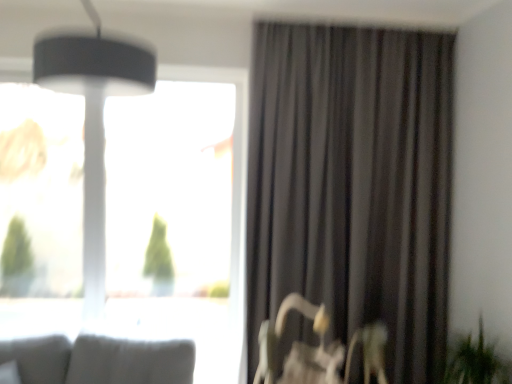
The image size is (512, 384). Describe the element at coordinates (353, 185) in the screenshot. I see `dark grey fabric curtain at right` at that location.

Describe the element at coordinates (476, 362) in the screenshot. I see `green leafy plant at lower right` at that location.

In order to face metallic silver swivel chair at lower right, should I rotate leftwards or rightwards?

You should rotate right by 9.099 degrees.

The image size is (512, 384). What do you see at coordinates (180, 213) in the screenshot?
I see `transparent glass window at upper left` at bounding box center [180, 213].

Locate an element on the screen. This screenshot has width=512, height=384. matte black lampshade at upper left is located at coordinates (93, 63).

Identify the location of dark grey fabric curtain at right. The height and width of the screenshot is (384, 512). (353, 185).

Between metallic silver swivel chair at lower right and matte black lampshade at upper left, which one has smaller size?

Smaller between the two is matte black lampshade at upper left.

Is metallic silver swivel chair at lower right situated inside matte black lampshade at upper left or outside?

metallic silver swivel chair at lower right lies outside matte black lampshade at upper left.

Is point (318, 364) closer to viewer compared to point (55, 47)?

No, it is behind (55, 47).

From a real-world perspective, is metallic silver swivel chair at lower right physically above matte black lampshade at upper left?

Incorrect, from a real-world perspective, metallic silver swivel chair at lower right is lower than matte black lampshade at upper left.

Who is shorter, transparent glass window at upper left or dark grey fabric curtain at right?

With less height is transparent glass window at upper left.

Does point (136, 137) lie in front of point (394, 354)?

No, (136, 137) is behind (394, 354).

From the image's perspective, would you say transparent glass window at upper left is positioned over dark grey fabric curtain at right?

Actually, transparent glass window at upper left appears below dark grey fabric curtain at right in the image.

Is transparent glass window at upper left facing towards dark grey fabric curtain at right?

No.

Who is bigger, transparent glass window at upper left or metallic silver swivel chair at lower right?

metallic silver swivel chair at lower right.

In terms of width, does transparent glass window at upper left look wider or thinner when compared to metallic silver swivel chair at lower right?

Considering their sizes, transparent glass window at upper left looks slimmer than metallic silver swivel chair at lower right.

Where is `window above the metallic silver swivel chair at lower right (from a real-world perspective)`? window above the metallic silver swivel chair at lower right (from a real-world perspective) is located at coordinates (180, 213).

Is transparent glass window at upper left looking in the opposite direction of metallic silver swivel chair at lower right?

No, transparent glass window at upper left is not facing the opposite direction of metallic silver swivel chair at lower right.

Considering the relative sizes of metallic silver swivel chair at lower right and dark grey fabric curtain at right in the image provided, is metallic silver swivel chair at lower right taller than dark grey fabric curtain at right?

No.

From the image's perspective, is metallic silver swivel chair at lower right beneath dark grey fabric curtain at right?

Yes, from the image's perspective, metallic silver swivel chair at lower right is beneath dark grey fabric curtain at right.

Considering the sizes of metallic silver swivel chair at lower right and dark grey fabric curtain at right in the image, is metallic silver swivel chair at lower right bigger or smaller than dark grey fabric curtain at right?

In the image, metallic silver swivel chair at lower right appears to be smaller than dark grey fabric curtain at right.

Looking at their sizes, would you say metallic silver swivel chair at lower right is wider or thinner than dark grey fabric curtain at right?

Clearly, metallic silver swivel chair at lower right has more width compared to dark grey fabric curtain at right.

From the image's perspective, is dark grey fabric curtain at right above metallic silver swivel chair at lower right?

Yes, from the image's perspective, dark grey fabric curtain at right is over metallic silver swivel chair at lower right.

Between dark grey fabric curtain at right and metallic silver swivel chair at lower right, which one appears on the left side from the viewer's perspective?

From the viewer's perspective, metallic silver swivel chair at lower right appears more on the left side.

In the scene shown: Measure the distance between dark grey fabric curtain at right and metallic silver swivel chair at lower right.

dark grey fabric curtain at right and metallic silver swivel chair at lower right are 25.63 inches apart from each other.

Is the position of dark grey fabric curtain at right more distant than that of metallic silver swivel chair at lower right?

Yes, the depth of dark grey fabric curtain at right is greater than that of metallic silver swivel chair at lower right.

Is metallic silver swivel chair at lower right directly adjacent to transparent glass window at upper left?

No, metallic silver swivel chair at lower right is not beside transparent glass window at upper left.

Is transparent glass window at upper left at the back of metallic silver swivel chair at lower right?

No, metallic silver swivel chair at lower right is not facing the opposite direction of transparent glass window at upper left.

Is transparent glass window at upper left surrounded by metallic silver swivel chair at lower right?

No.

From the image's perspective, which object appears higher, metallic silver swivel chair at lower right or transparent glass window at upper left?

From the image's view, transparent glass window at upper left is above.

Can you confirm if dark grey fabric curtain at right is shorter than transparent glass window at upper left?

In fact, dark grey fabric curtain at right may be taller than transparent glass window at upper left.

Is dark grey fabric curtain at right beside transparent glass window at upper left?

No, dark grey fabric curtain at right is not beside transparent glass window at upper left.

From a real-world perspective, does dark grey fabric curtain at right sit lower than transparent glass window at upper left?

Actually, dark grey fabric curtain at right is physically above transparent glass window at upper left in the real world.

Can you tell me how much dark grey fabric curtain at right and transparent glass window at upper left differ in facing direction?

0.18 degrees.

Identify the location of lamp above the metallic silver swivel chair at lower right (from a real-world perspective). This screenshot has height=384, width=512. (93, 63).

The width and height of the screenshot is (512, 384). I want to click on curtain in front of the transparent glass window at upper left, so click(x=353, y=185).

Looking at the image, which one is located further to transparent glass window at upper left, matte black lampshade at upper left or dark grey fabric curtain at right?

matte black lampshade at upper left is positioned further to the anchor transparent glass window at upper left.

Looking at the image, which one is located closer to transparent glass window at upper left, green leafy plant at lower right or metallic silver swivel chair at lower right?

metallic silver swivel chair at lower right is closer to transparent glass window at upper left.

Based on their spatial positions, is transparent glass window at upper left or matte black lampshade at upper left closer to green leafy plant at lower right?

matte black lampshade at upper left is closer to green leafy plant at lower right.

Considering their positions, is metallic silver swivel chair at lower right positioned closer to transparent glass window at upper left than green leafy plant at lower right?

→ The object closer to transparent glass window at upper left is metallic silver swivel chair at lower right.

Looking at the image, which one is located further to dark grey fabric curtain at right, green leafy plant at lower right or transparent glass window at upper left?

Based on the image, transparent glass window at upper left appears to be further to dark grey fabric curtain at right.

Which object lies nearer to the anchor point green leafy plant at lower right, transparent glass window at upper left or metallic silver swivel chair at lower right?

metallic silver swivel chair at lower right is positioned closer to the anchor green leafy plant at lower right.

Consider the image. Estimate the real-world distances between objects in this image. Which object is further from dark grey fabric curtain at right, green leafy plant at lower right or matte black lampshade at upper left?

matte black lampshade at upper left is positioned further to the anchor dark grey fabric curtain at right.

Looking at the image, which one is located closer to transparent glass window at upper left, matte black lampshade at upper left or green leafy plant at lower right?

Among the two, matte black lampshade at upper left is located nearer to transparent glass window at upper left.

This screenshot has width=512, height=384. Identify the location of plant between matte black lampshade at upper left and metallic silver swivel chair at lower right from top to bottom. (476, 362).

Locate an element on the screen. This screenshot has width=512, height=384. curtain between matte black lampshade at upper left and transparent glass window at upper left in the front-back direction is located at coordinates click(x=353, y=185).

This screenshot has width=512, height=384. What are the coordinates of `curtain located between transparent glass window at upper left and green leafy plant at lower right in the left-right direction` in the screenshot? It's located at (353, 185).

At what (x,y) coordinates should I click in order to perform the action: click on swivel chair positioned between matte black lampshade at upper left and dark grey fabric curtain at right from near to far. Please return your answer as a coordinate pair (x, y). The width and height of the screenshot is (512, 384). Looking at the image, I should click on (301, 349).